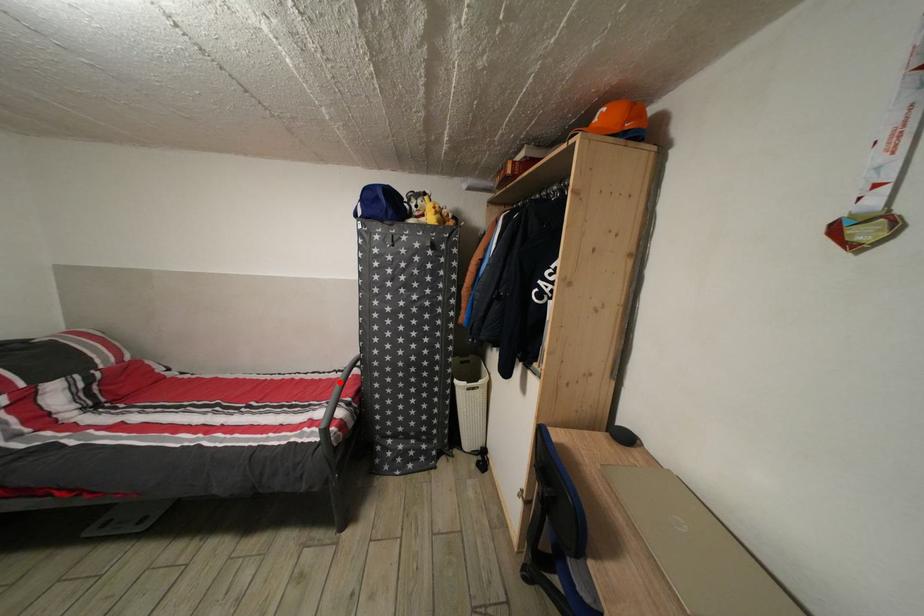
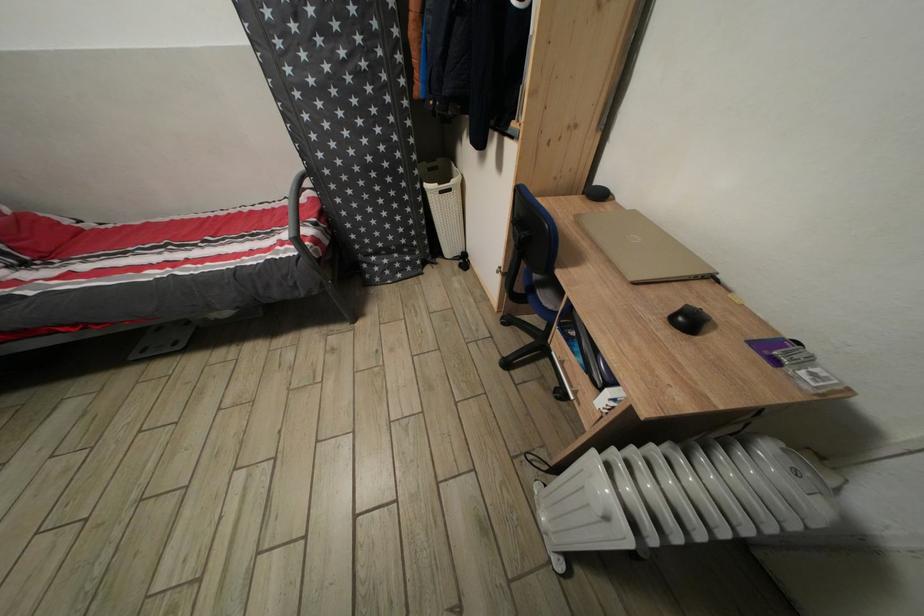
Where in the second image is the point corresponding to the highlighted location from the first image?

(294, 209)